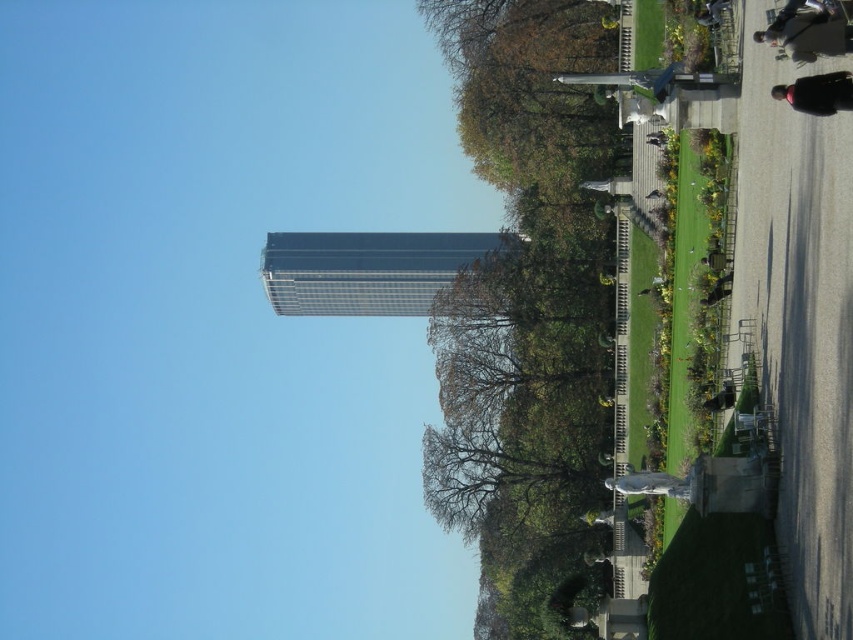
Who is more distant from viewer, (492, 484) or (788, 97)?

The point (492, 484) is more distant.

Does green leafy tree at upper center have a greater height compared to black matte jacket at lower right?

Correct, green leafy tree at upper center is much taller as black matte jacket at lower right.

Is point (497, 584) less distant than point (795, 84)?

No.

Where is `green leafy tree at upper center`? green leafy tree at upper center is located at coordinates (527, 314).

Is black matte jacket at lower right smaller than dark gray jacket at upper right?

Yes, black matte jacket at lower right is smaller than dark gray jacket at upper right.

Between point (821, 100) and point (787, 6), which one is positioned in front?

Point (821, 100) is in front.

Locate an element on the screen. black matte jacket at lower right is located at coordinates (817, 93).

Who is more distant from viewer, (490, 122) or (766, 29)?

The point (490, 122) is behind.

Is green leafy tree at upper center to the right of dark gray jacket at upper right from the viewer's perspective?

No, green leafy tree at upper center is not to the right of dark gray jacket at upper right.

Does point (550, 380) come farther from viewer compared to point (786, 19)?

Yes, point (550, 380) is farther from viewer.

This screenshot has width=853, height=640. Find the location of `green leafy tree at upper center`. green leafy tree at upper center is located at coordinates (527, 314).